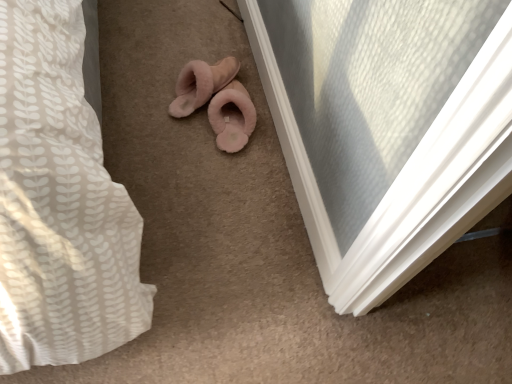
Image resolution: width=512 pixels, height=384 pixels. Describe the element at coordinates (232, 117) in the screenshot. I see `pink suede slippers at center` at that location.

Find the location of a particular element. pink suede slippers at center is located at coordinates (232, 117).

Find the location of `pink suede slippers at center`. pink suede slippers at center is located at coordinates (232, 117).